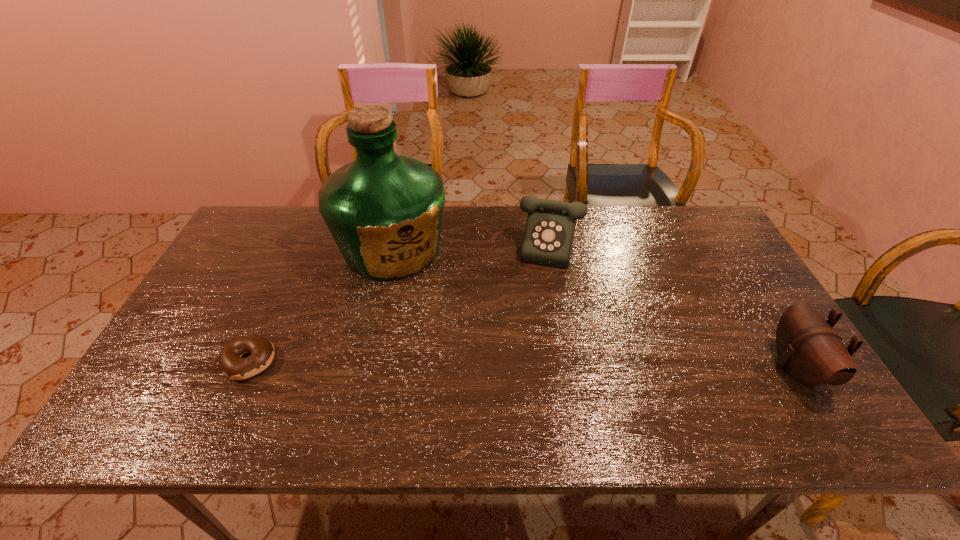
Where is `the shortest object`? The image size is (960, 540). the shortest object is located at coordinates (231, 363).

Image resolution: width=960 pixels, height=540 pixels. Find the location of `the leftmost object`. the leftmost object is located at coordinates (231, 363).

The height and width of the screenshot is (540, 960). Find the location of `pouch`. pouch is located at coordinates (811, 352).

Locate an element on the screen. The image size is (960, 540). liquor is located at coordinates (384, 211).

Identify the location of the third object from right to left. (384, 211).

What are the coordinates of `telephone` in the screenshot? It's located at (548, 237).

Image resolution: width=960 pixels, height=540 pixels. What are the coordinates of `free space located on the right of the doughnut` in the screenshot? It's located at (389, 361).

At what (x,y) coordinates should I click in order to perform the action: click on free region located with the flap open on the pouch. Please return your answer as a coordinate pair (x, y). Image resolution: width=960 pixels, height=540 pixels. Looking at the image, I should click on point(730,368).

Image resolution: width=960 pixels, height=540 pixels. Find the location of `free region located with the flap open on the pouch`. free region located with the flap open on the pouch is located at coordinates (754, 368).

Locate an element on the screen. vacant position located 0.320m with the flap open on the pouch is located at coordinates (642, 368).